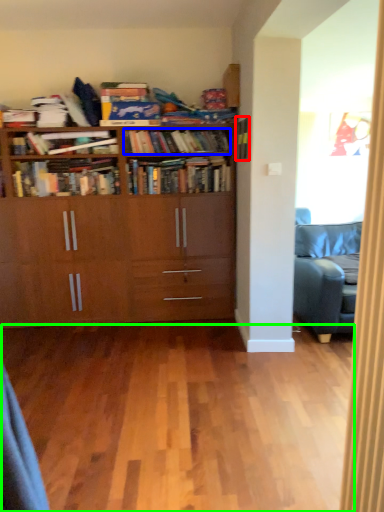
Question: Which is nearer to the book (highlighted by a red box)? book (highlighted by a blue box) or plain (highlighted by a green box).

Choices:
 (A) book
 (B) plain

Answer: (A)